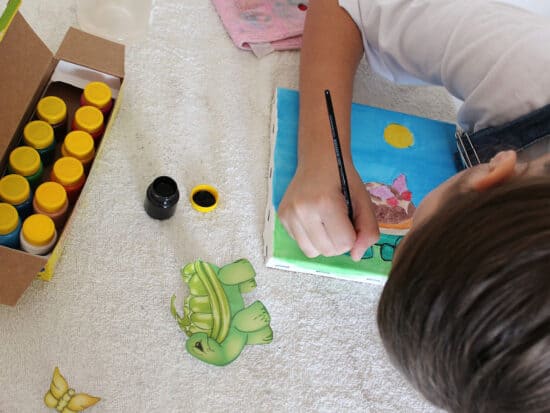
Locate an element on the screen. The height and width of the screenshot is (413, 550). paint bottles is located at coordinates coord(29,132), coord(44,223).